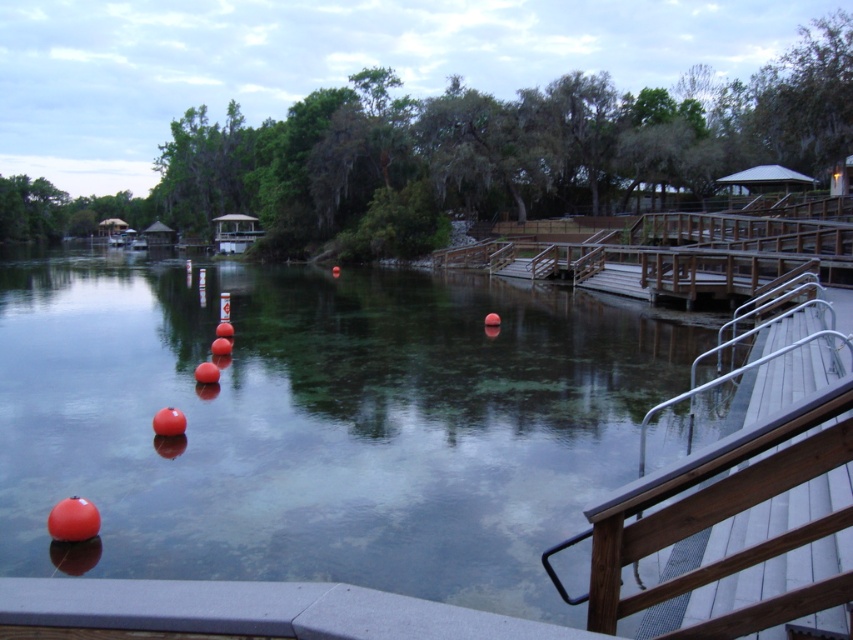
You are standing on the wooden deck and want to locate the transparent water at center. According to the coordinates provided, where exactly would you find it?

The transparent water at center is located at the coordinates point 0.658 on the x axis and 0.376 on the y axis.

You are standing on the wooden deck looking out at the river. There are two points marked on the water surface. One is at coordinates point (x=498, y=541) and the other is at point (x=730, y=497). Which of these two points is closer to you?

Point (x=498, y=541) is closer to you because it is further to the viewer than point (x=730, y=497).